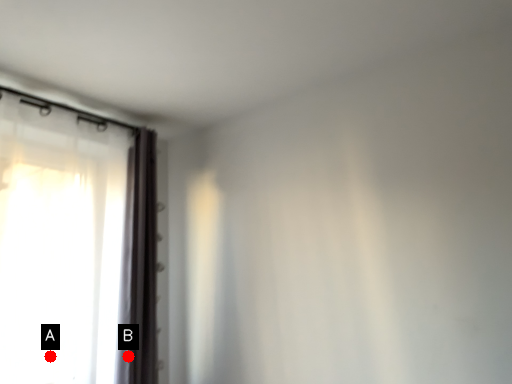
Question: Two points are circled on the image, labeled by A and B beside each circle. Which point is closer to the camera?

Choices:
 (A) A is closer
 (B) B is closer

Answer: (A)